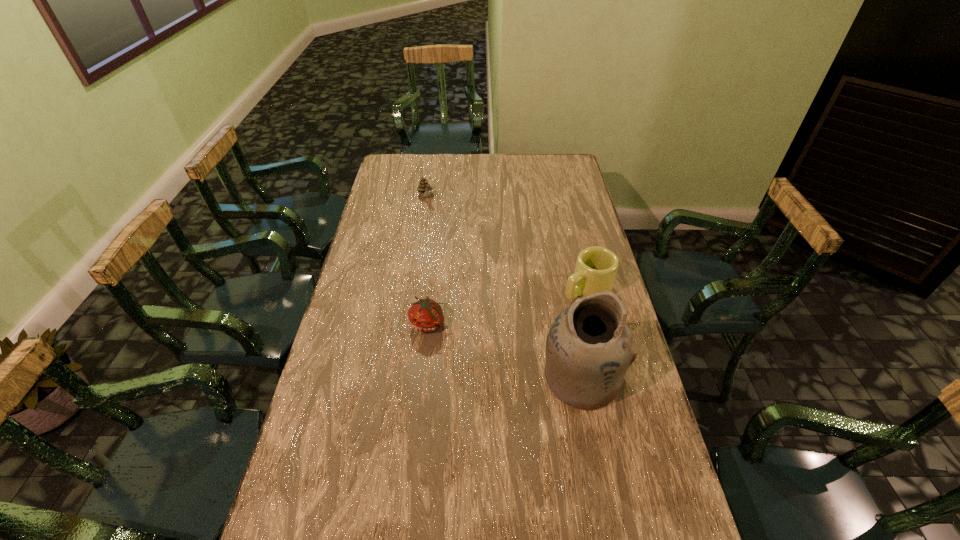
Locate an element on the screen. This screenshot has height=540, width=960. the shortest object is located at coordinates (426, 315).

The width and height of the screenshot is (960, 540). Find the location of `tomato`. tomato is located at coordinates (426, 315).

At what (x,y) coordinates should I click in order to perform the action: click on the tallest object. Please return your answer as a coordinate pair (x, y). Image resolution: width=960 pixels, height=540 pixels. Looking at the image, I should click on click(589, 348).

Where is `the nearest object`? This screenshot has height=540, width=960. the nearest object is located at coordinates (589, 348).

Find the location of a particular element. snail is located at coordinates (424, 187).

Identify the location of mug. (596, 267).

The image size is (960, 540). What are the coordinates of `vacant space positioned 0.210m on the front-facing side of the shortest object` in the screenshot? It's located at (420, 399).

I want to click on blank space located on the back of the tallest object, so click(562, 278).

What are the coordinates of `free location located on the face of the farthest object` in the screenshot? It's located at [x=437, y=223].

Where is `vacant space located on the face of the farthest object`? vacant space located on the face of the farthest object is located at coordinates (436, 221).